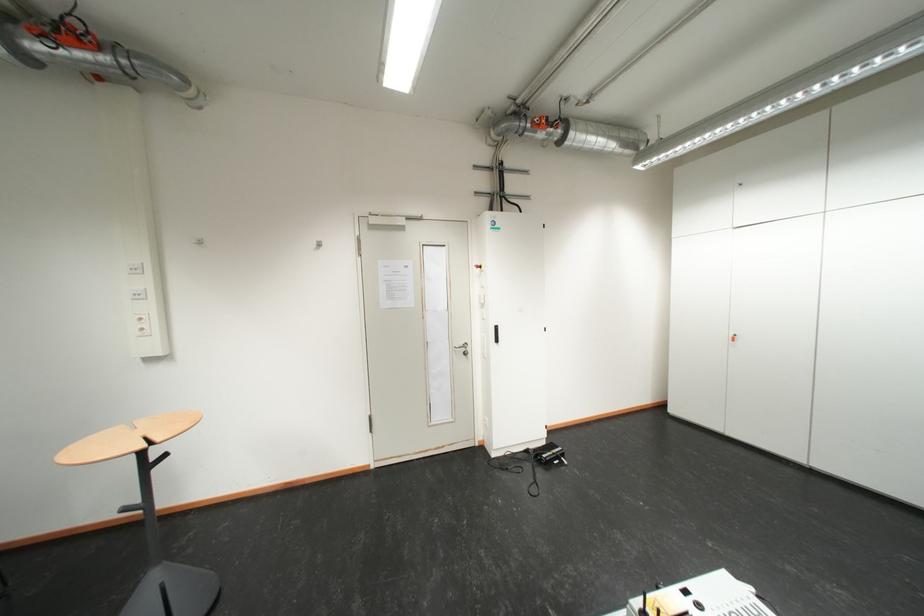
Where is `silver door handle`? The image size is (924, 616). silver door handle is located at coordinates (463, 347).